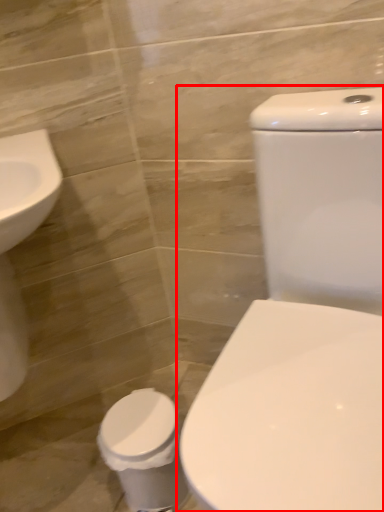
Question: Where is toilet (annotated by the red box) located in relation to toilet bowl in the image?

Choices:
 (A) left
 (B) right

Answer: (B)